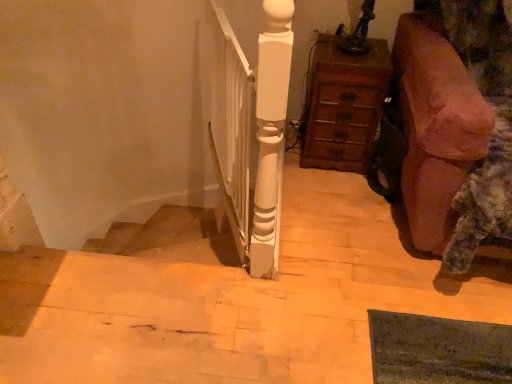
Question: From the image's perspective, is brown fabric couch at right positioned above or below white glossy wooden post at center?

Choices:
 (A) above
 (B) below

Answer: (B)

Question: Would you say brown fabric couch at right is inside or outside white glossy wooden post at center?

Choices:
 (A) outside
 (B) inside

Answer: (A)

Question: Which object is positioned farthest from the wooden chest of drawers at right?

Choices:
 (A) white glossy wooden post at center
 (B) brown fabric couch at right

Answer: (A)

Question: Which object is the closest to the white glossy wooden post at center?

Choices:
 (A) brown fabric couch at right
 (B) wooden chest of drawers at right

Answer: (B)